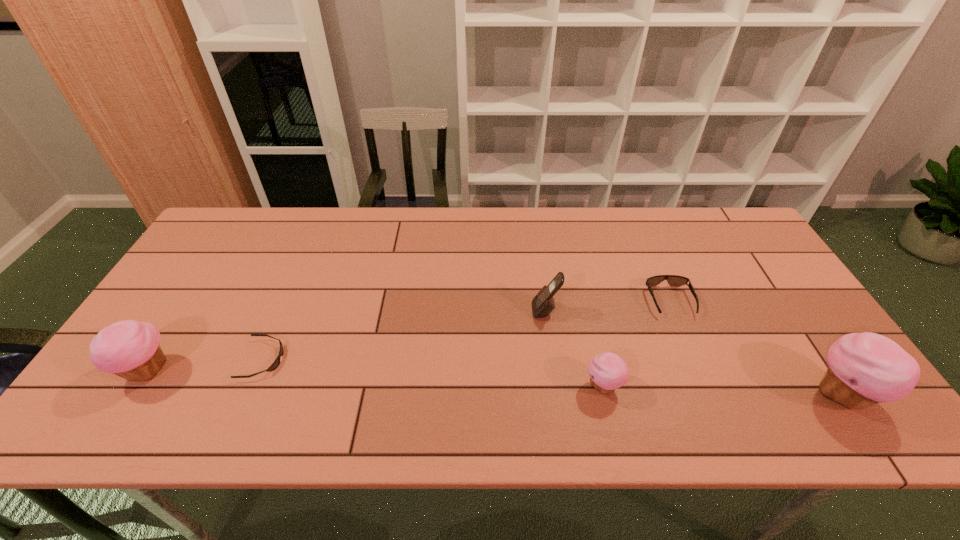
You are a GUI agent. You are given a task and a screenshot of the screen. Output one action in this format:
    pyautogui.click(x=<x>, y=<y>)
    Task: Click on the vacant space located on the back of the second shortest cupcake
    This screenshot has width=960, height=540.
    Given the screenshot: What is the action you would take?
    pyautogui.click(x=171, y=334)

Locate an element on the screen. vacant area situated on the back of the third object from right to left is located at coordinates (575, 265).

This screenshot has width=960, height=540. I want to click on free location located on the left of the rightmost object, so click(x=773, y=394).

At what (x,y) coordinates should I click in order to perform the action: click on free location located 0.390m on the front-facing side of the cellular telephone. Please return your answer as a coordinate pair (x, y). Looking at the image, I should click on [x=389, y=310].

Locate an element on the screen. vacant space positioned 0.350m on the front-facing side of the cellular telephone is located at coordinates (404, 310).

Identify the location of vacant space situated 0.290m on the front-facing side of the cellular telephone. (426, 310).

This screenshot has width=960, height=540. What are the coordinates of `free spot located 0.190m on the front-facing side of the fifth object from left to right` in the screenshot? It's located at (703, 380).

At what (x,y) coordinates should I click in order to perform the action: click on vacant space located on the front-facing side of the left sunglasses. Please return your answer as a coordinate pair (x, y). Looking at the image, I should click on (379, 360).

Where is `sunglasses located in the near edge section of the desktop`? This screenshot has height=540, width=960. sunglasses located in the near edge section of the desktop is located at coordinates (275, 364).

Locate an element on the screen. This screenshot has height=540, width=960. object located at the left edge is located at coordinates (130, 349).